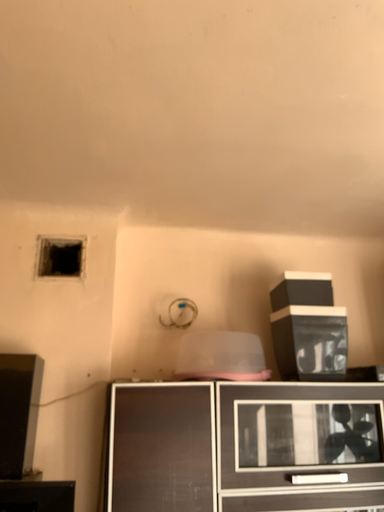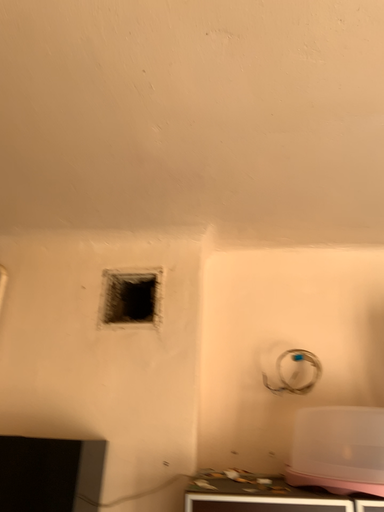
Question: Which way did the camera rotate in the video?

Choices:
 (A) rotated left
 (B) rotated right

Answer: (A)